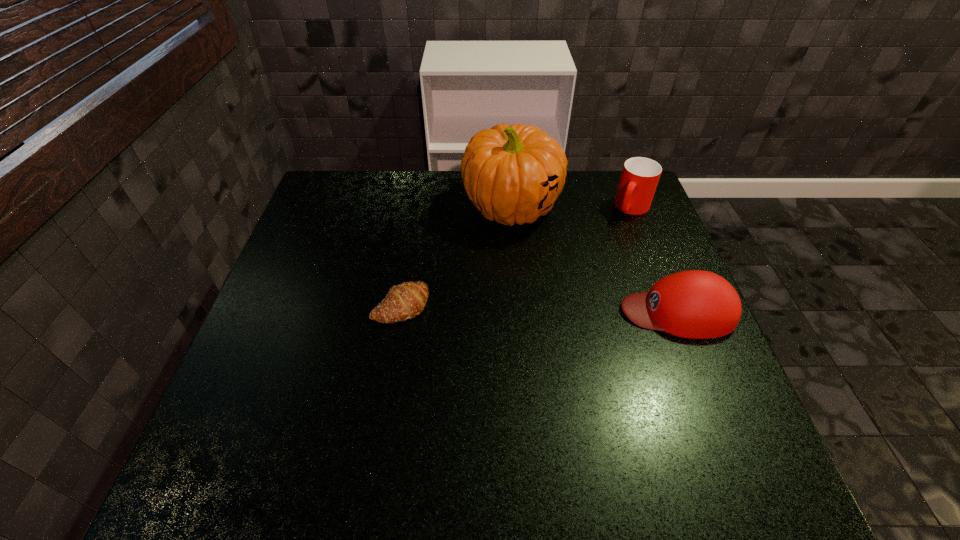
What are the coordinates of `free spot on the desktop that is between the crescent roll and the baseball cap and is positioned on the surface of the pumpkin` in the screenshot? It's located at (505, 308).

Locate an element on the screen. free space on the desktop that is between the leftmost object and the second shortest object and is positioned on the side of the cup with the handle is located at coordinates (552, 308).